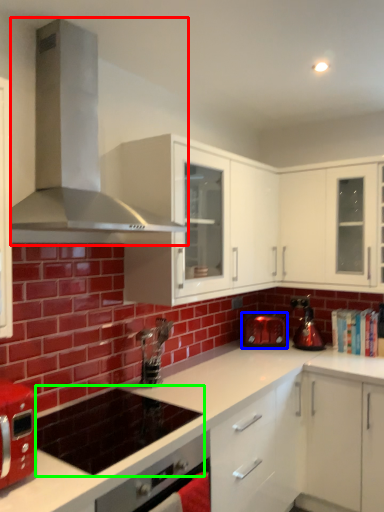
Question: Which object is positioned closest to home appliance (highlighted by a red box)? Select from kitchen appliance (highlighted by a blue box) and appliance (highlighted by a green box).

Choices:
 (A) kitchen appliance
 (B) appliance

Answer: (B)